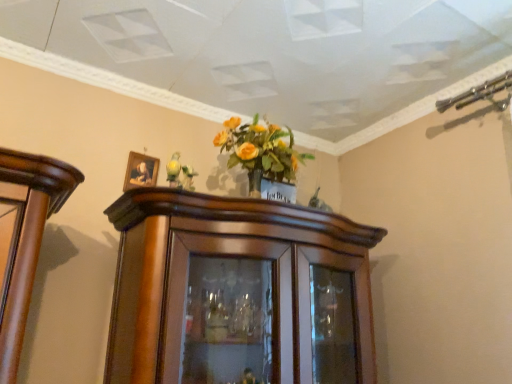
Locate an element on the screen. This screenshot has width=512, height=384. matte gold picture frame at upper center is located at coordinates (140, 171).

Measure the distance between point (149,167) and camera.

A distance of 1.81 meters exists between point (149,167) and camera.

Describe the element at coordinates (140, 171) in the screenshot. This screenshot has height=384, width=512. I see `matte gold picture frame at upper center` at that location.

The width and height of the screenshot is (512, 384). In order to click on matte gold picture frame at upper center in this screenshot , I will do `click(140, 171)`.